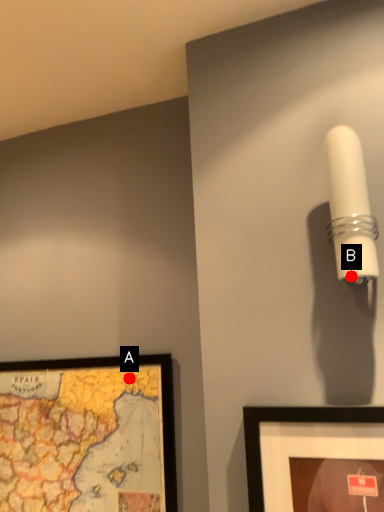
Question: Two points are circled on the image, labeled by A and B beside each circle. Which point is closer to the camera taking this photo?

Choices:
 (A) A is closer
 (B) B is closer

Answer: (B)